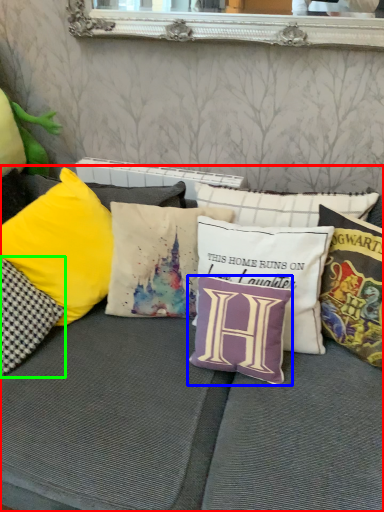
Question: Considering the real-world distances, which object is farthest from studio couch (highlighted by a red box)? pillow (highlighted by a blue box) or pillow (highlighted by a green box)?

Choices:
 (A) pillow
 (B) pillow

Answer: (B)